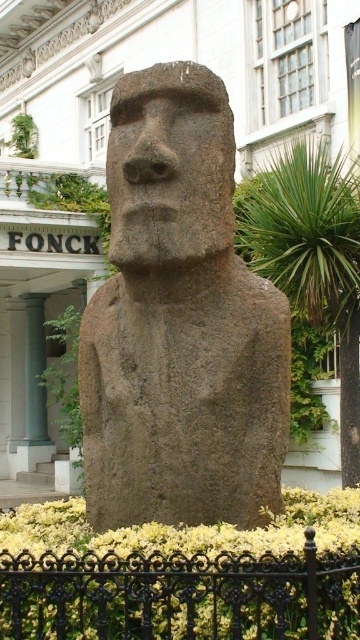
You are a tour guide explaining the Moai statues to visitors. You point out the brown stone statue at center and the brown stone head at center. Which part of the statue is positioned lower?

The brown stone statue at center is positioned lower than the brown stone head at center because the statue is below the head.